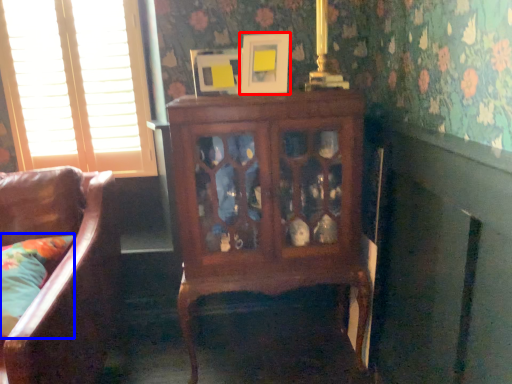
Question: Which point is further to the camera, picture frame (highlighted by a red box) or pillow (highlighted by a blue box)?

Choices:
 (A) picture frame
 (B) pillow

Answer: (A)